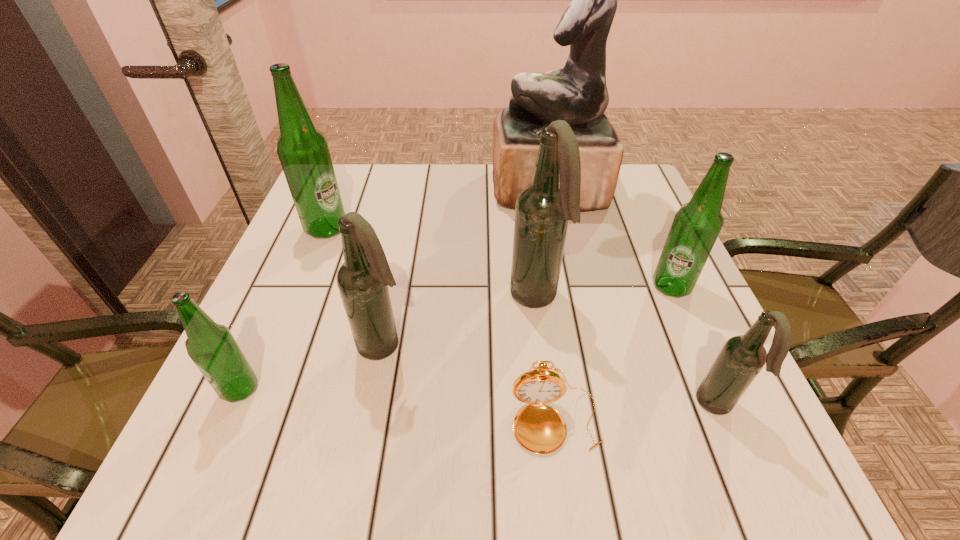
Where is `the closest object to the sixth object from right to left`? Image resolution: width=960 pixels, height=540 pixels. the closest object to the sixth object from right to left is located at coordinates (211, 346).

Select which beer bottle is the third closest to the biggest green beer bottle. Please provide its 2D coordinates. Your answer should be formatted as a tuple, i.e. [(x, y)], where the tuple contains the x and y coordinates of a point satisfying the conditions above.

[(543, 209)]

Locate an element on the screen. The height and width of the screenshot is (540, 960). beer bottle that is the fifth closest to the leftmost dark beer bottle is located at coordinates (695, 228).

This screenshot has height=540, width=960. Find the location of `green beer bottle identified as the second closest to the second dark beer bottle from right to left`. green beer bottle identified as the second closest to the second dark beer bottle from right to left is located at coordinates (303, 151).

Where is `the second closest green beer bottle relative to the second dark beer bottle from right to left`? This screenshot has width=960, height=540. the second closest green beer bottle relative to the second dark beer bottle from right to left is located at coordinates click(303, 151).

Where is `the second closest dark beer bottle to the rightmost dark beer bottle`? The width and height of the screenshot is (960, 540). the second closest dark beer bottle to the rightmost dark beer bottle is located at coordinates (363, 279).

Locate which dark beer bottle ranks in proximity to the smallest green beer bottle. Please provide its 2D coordinates. Your answer should be formatted as a tuple, i.e. [(x, y)], where the tuple contains the x and y coordinates of a point satisfying the conditions above.

[(363, 279)]

Locate an element on the screen. vacant area that satisfies the following two spatial constraints: 1. on the label of the farthest green beer bottle; 2. on the label of the nearest green beer bottle is located at coordinates (261, 389).

The width and height of the screenshot is (960, 540). I want to click on free space that satisfies the following two spatial constraints: 1. in a relaxed pose on the smallest dark beer bottle; 2. on the right side of the tallest object, so click(x=591, y=406).

Find the location of a particular element. The height and width of the screenshot is (540, 960). free spot that satisfies the following two spatial constraints: 1. on the label of the farthest green beer bottle; 2. on the left side of the leftmost dark beer bottle is located at coordinates click(x=279, y=345).